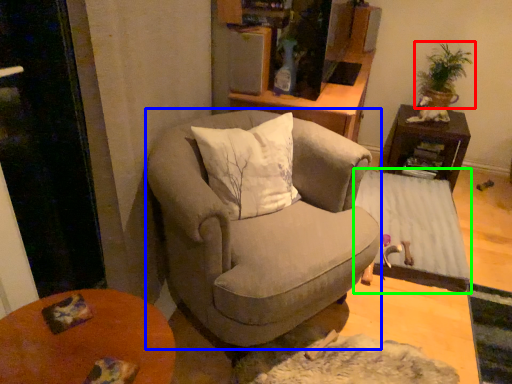
Question: Considering the real-world distances, which object is closest to houseplant (highlighted by a red box)? chair (highlighted by a blue box) or table (highlighted by a green box).

Choices:
 (A) chair
 (B) table

Answer: (B)